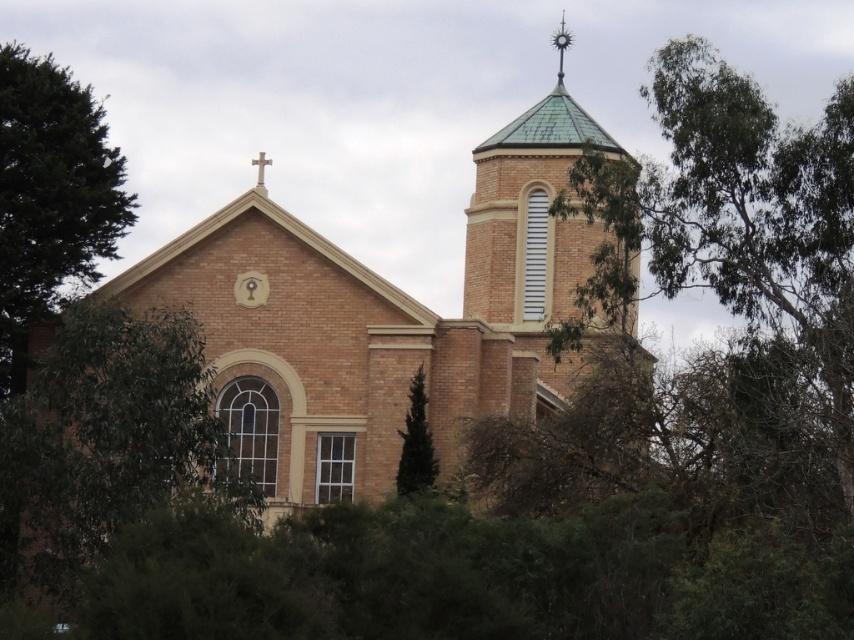
You are standing at the entrance of the church and want to find the green leafy tree at lower left. According to the coordinates provided, in which direction should you look to locate it?

The green leafy tree at lower left is located at coordinates point (107, 445), so you should look to the lower left direction to find it.

In the scene shown: You are standing in front of the church and want to take a photo that includes both the green leafy tree at left and the metallic spire at upper center. Which object will appear taller in your photo?

The green leafy tree at left appears taller in the photo because it has a greater height compared to the metallic spire at upper center.